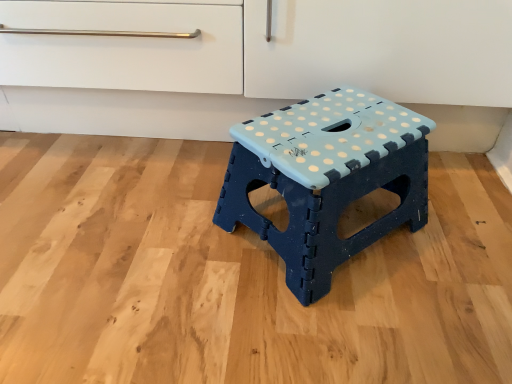
Locate an element on the screen. vacant space situated on the left part of blue textured stool at center is located at coordinates (157, 234).